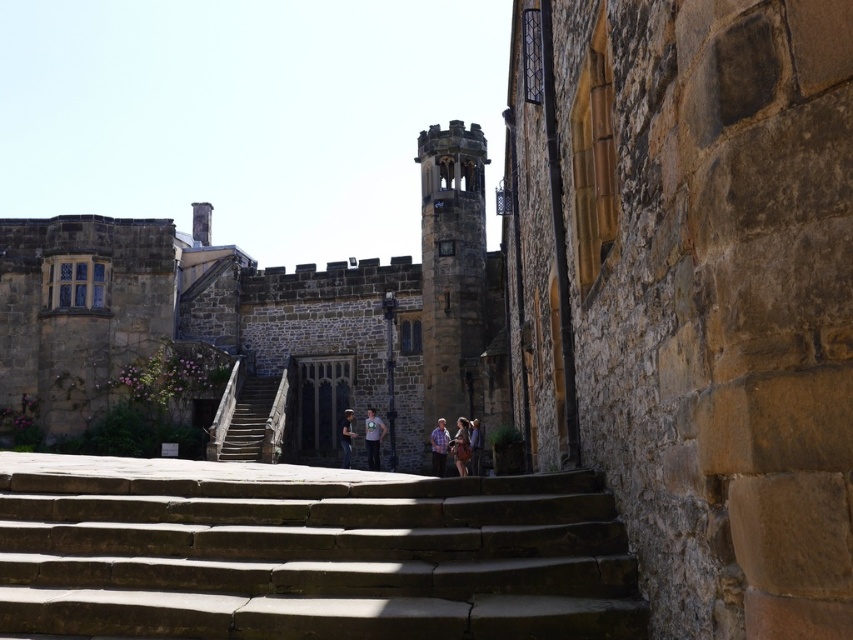
Which is in front, point (376, 429) or point (440, 448)?

Point (440, 448)

Is point (370, 429) closer to camera compared to point (444, 444)?

No.

At what (x,y) coordinates should I click in order to perform the action: click on light blue t-shirt at center. Please return your answer as a coordinate pair (x, y). The height and width of the screenshot is (640, 853). Looking at the image, I should click on (373, 436).

This screenshot has height=640, width=853. What do you see at coordinates (373, 436) in the screenshot?
I see `light blue t-shirt at center` at bounding box center [373, 436].

Can you confirm if light blue t-shirt at center is positioned to the right of denim jacket at center?

Correct, you'll find light blue t-shirt at center to the right of denim jacket at center.

Does point (374, 420) come closer to viewer compared to point (347, 433)?

Yes.

This screenshot has height=640, width=853. I want to click on light blue t-shirt at center, so click(x=373, y=436).

Can you confirm if wooden stairs at center is smaller than light blue t-shirt at center?

Actually, wooden stairs at center might be larger than light blue t-shirt at center.

Is wooden stairs at center wider than light blue t-shirt at center?

Correct, the width of wooden stairs at center exceeds that of light blue t-shirt at center.

In the scene shown: Who is more distant from viewer, (224, 456) or (367, 451)?

The point (367, 451) is behind.

Identify the location of wooden stairs at center. (248, 419).